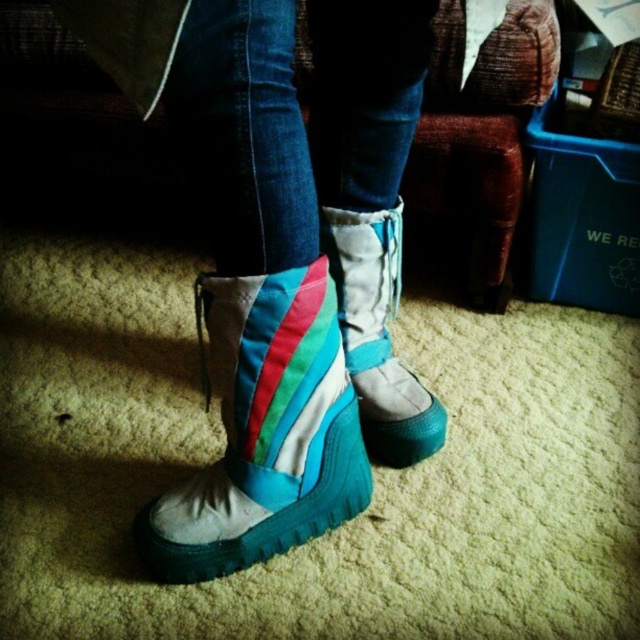
Can you confirm if teal fabric boots at center is thinner than teal suede boot at center?

Incorrect, teal fabric boots at center's width is not less than teal suede boot at center's.

Measure the distance between teal fabric boots at center and teal suede boot at center.

teal fabric boots at center is 4.17 inches away from teal suede boot at center.

This screenshot has height=640, width=640. Describe the element at coordinates (296, 272) in the screenshot. I see `teal fabric boots at center` at that location.

Where is `teal fabric boots at center`? Image resolution: width=640 pixels, height=640 pixels. teal fabric boots at center is located at coordinates (296, 272).

Which is in front, point (300, 433) or point (339, 260)?

Positioned in front is point (300, 433).

Who is taller, teal fabric boot at lower center or teal suede boot at center?

teal fabric boot at lower center is taller.

The image size is (640, 640). Describe the element at coordinates (264, 429) in the screenshot. I see `teal fabric boot at lower center` at that location.

Find the location of a particular element. Image resolution: width=640 pixels, height=640 pixels. teal fabric boot at lower center is located at coordinates (264, 429).

From the picture: Which is more to the right, teal fabric boots at center or teal fabric boot at lower center?

Positioned to the right is teal fabric boots at center.

Can you confirm if teal fabric boots at center is positioned above teal fabric boot at lower center?

Yes, teal fabric boots at center is above teal fabric boot at lower center.

Is point (326, 497) more distant than point (292, 458)?

Yes, point (326, 497) is behind point (292, 458).

Identify the location of teal fabric boots at center. This screenshot has width=640, height=640. (296, 272).